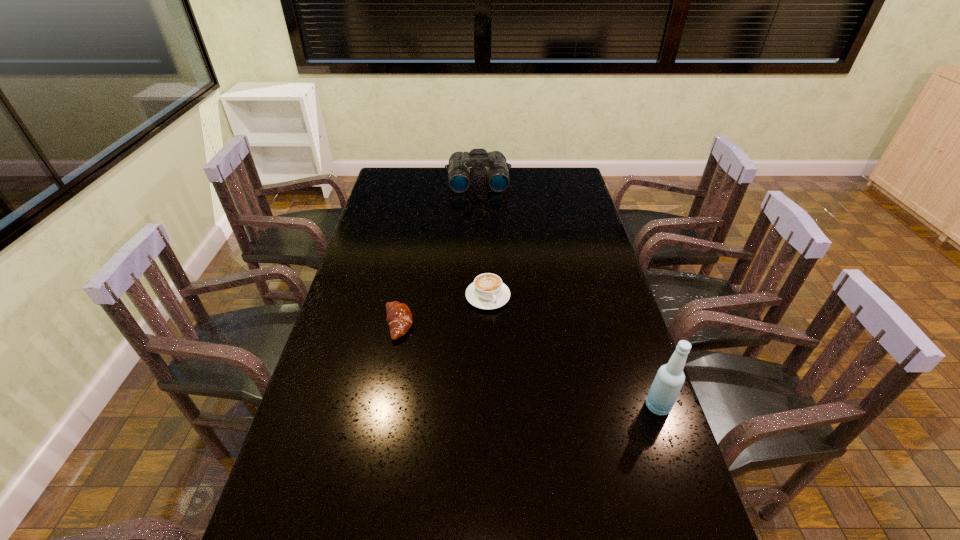
At what (x,y) coordinates should I click in order to perform the action: click on free point at the right edge. Please return your answer as a coordinate pair (x, y). The height and width of the screenshot is (540, 960). Looking at the image, I should click on (588, 211).

Locate an element on the screen. vacant space at the far left corner is located at coordinates (409, 180).

At what (x,y) coordinates should I click in order to perform the action: click on vacant space at the far right corner of the desktop. Please return your answer as a coordinate pair (x, y). This screenshot has height=540, width=960. Looking at the image, I should click on (553, 185).

This screenshot has height=540, width=960. Find the location of `vacant point located between the cappuccino and the crescent roll`. vacant point located between the cappuccino and the crescent roll is located at coordinates click(443, 310).

This screenshot has width=960, height=540. I want to click on free space between the crescent roll and the third tallest object, so click(x=443, y=310).

I want to click on free spot between the third tallest object and the second tallest object, so click(483, 239).

Where is `empty space between the shortest object and the second tallest object`? empty space between the shortest object and the second tallest object is located at coordinates (438, 253).

Locate an element on the screen. The width and height of the screenshot is (960, 540). unoccupied area between the second shortest object and the binoculars is located at coordinates (483, 239).

Locate an element on the screen. This screenshot has height=540, width=960. vacant space in between the cappuccino and the bottle is located at coordinates (573, 352).

You are a GUI agent. You are given a task and a screenshot of the screen. Output one action in this format:
    pyautogui.click(x=<x>, y=<y>)
    Task: Click on the blank region between the second tallest object and the crescent roll
    
    Given the screenshot: What is the action you would take?
    pyautogui.click(x=438, y=253)